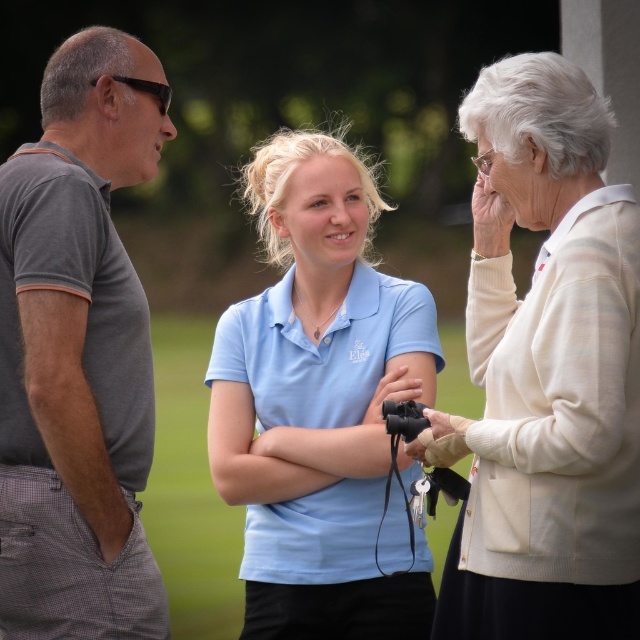
Question: Can you confirm if matte blue shirt at center is thinner than gray cotton polo shirt at left?

Choices:
 (A) no
 (B) yes

Answer: (A)

Question: Can you confirm if white knit cardigan at upper right is positioned to the left of gray cotton polo shirt at left?

Choices:
 (A) no
 (B) yes

Answer: (A)

Question: Among these points, which one is nearest to the camera?

Choices:
 (A) (400, 435)
 (B) (284, 388)
 (C) (557, 332)

Answer: (C)

Question: Does white knit cardigan at upper right appear over matte blue shirt at center?

Choices:
 (A) no
 (B) yes

Answer: (B)

Question: Which is farther from the white knit cardigan at upper right?

Choices:
 (A) gray cotton polo shirt at left
 (B) black rubber binoculars at center
 (C) matte blue shirt at center

Answer: (A)

Question: Which object is farther from the camera taking this photo?

Choices:
 (A) black rubber binoculars at center
 (B) white knit cardigan at upper right

Answer: (A)